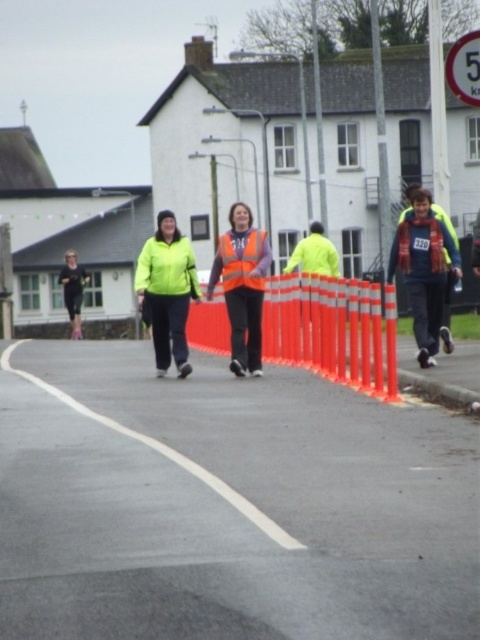
You are a participant in the race and you see both the green matte jacket at center and the high visibility fabric safety vest at center. Which one is closer to you?

The green matte jacket at center is closer to you because it is further to the viewer than the high visibility fabric safety vest at center.

You are a photographer positioned at the center of the street scene. You need to capture a photo where both the black running suit at left and the reflective yellow jacket at right are clearly visible. Considering their heights, which person should you focus on first to ensure both are in frame?

The black running suit at left is taller than the reflective yellow jacket at right. To ensure both are in frame, focus on the taller individual first, which is the black running suit at left, then adjust the camera angle to include the shorter reflective yellow jacket at right.